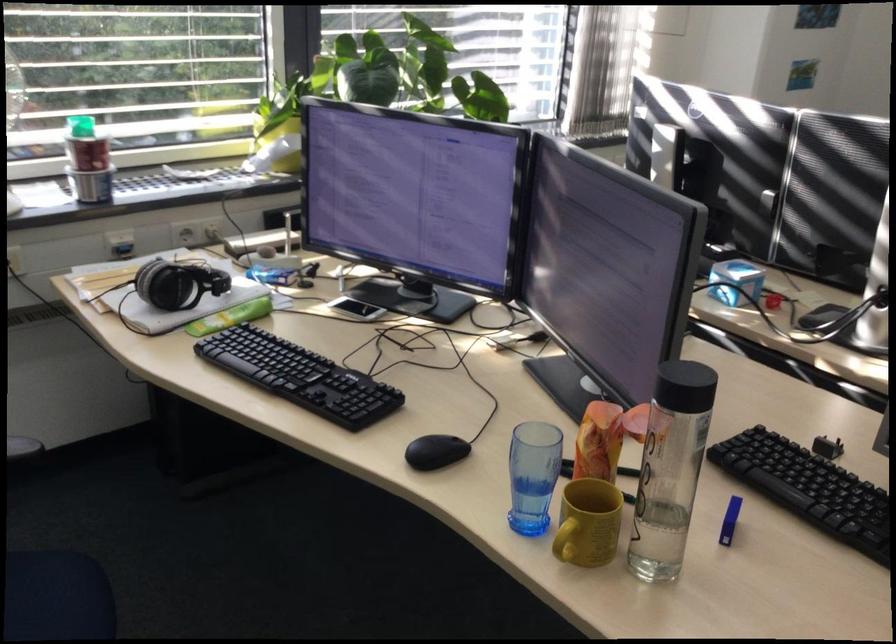
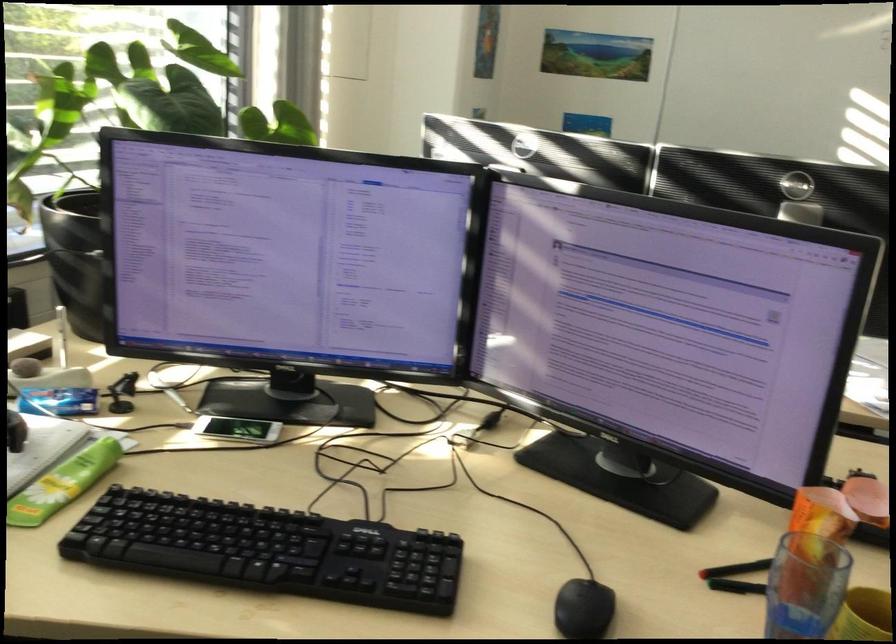
Find the pixel in the second image that matches point 235,313 in the first image.

(64, 483)